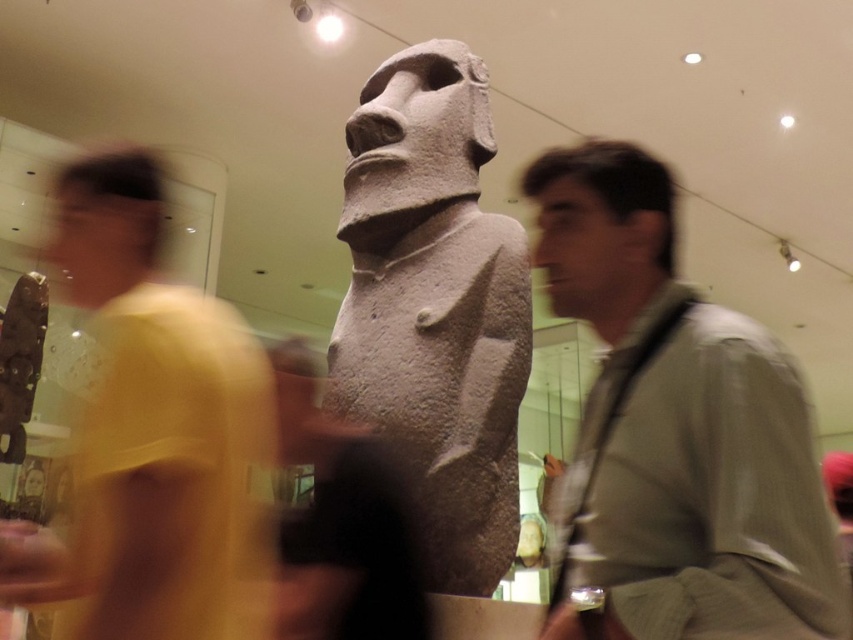
Measure the distance between point [734,408] and camera.

26.59 meters

Can you confirm if light brown leather jacket at center is thinner than yellow matte shirt at left?

Correct, light brown leather jacket at center's width is less than yellow matte shirt at left's.

What do you see at coordinates (676, 429) in the screenshot? The image size is (853, 640). I see `light brown leather jacket at center` at bounding box center [676, 429].

The width and height of the screenshot is (853, 640). In order to click on light brown leather jacket at center in this screenshot , I will do `click(676, 429)`.

Is yellow matte shirt at left further to camera compared to gray stone statue at center?

No, yellow matte shirt at left is closer to the viewer.

Who is more forward, (242,520) or (392,289)?

Point (242,520) is more forward.

Describe the element at coordinates (151, 435) in the screenshot. I see `yellow matte shirt at left` at that location.

This screenshot has height=640, width=853. Find the location of `yellow matte shirt at left`. yellow matte shirt at left is located at coordinates (151, 435).

Between light brown leather jacket at center and gray stone statue at center, which one is positioned higher?

light brown leather jacket at center is higher up.

Is light brown leather jacket at center below gray stone statue at center?

No, light brown leather jacket at center is not below gray stone statue at center.

Does point (753, 483) lie in front of point (480, 236)?

That is True.

Locate an element on the screen. The image size is (853, 640). light brown leather jacket at center is located at coordinates (676, 429).